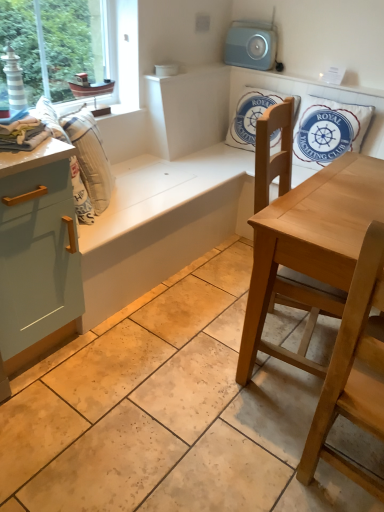
Identify the location of free space to the left of light wood chair at center, which is the first chair in back-to-front order. click(188, 337).